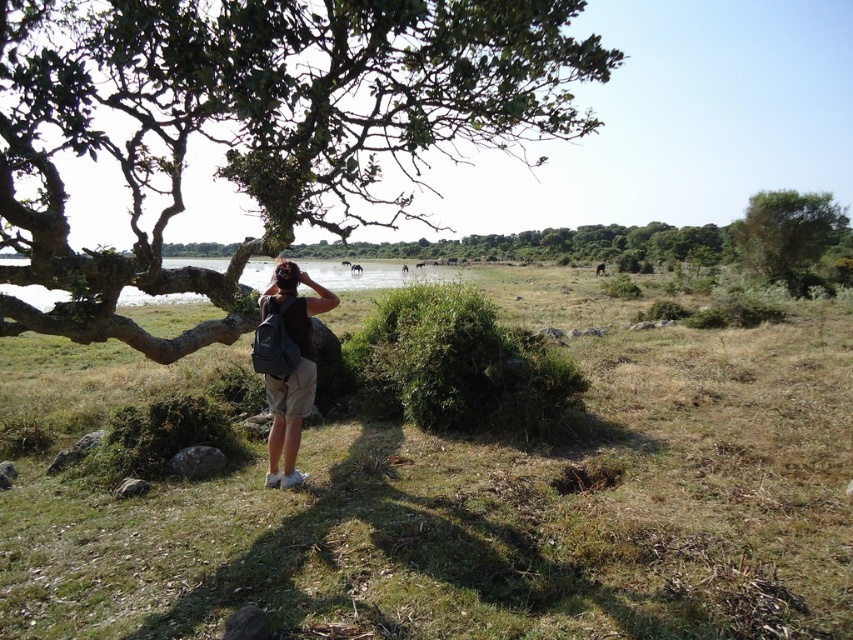
Question: Which point is closer to the camera?

Choices:
 (A) (788, 237)
 (B) (305, 141)

Answer: (B)

Question: Which of the following is the closest to the observer?

Choices:
 (A) green leafy tree at upper left
 (B) green leafy bush at upper right
 (C) green grass at center

Answer: (A)

Question: Can you confirm if green leafy bush at upper right is positioned to the left of black fabric backpack at center?

Choices:
 (A) no
 (B) yes

Answer: (A)

Question: Can you confirm if green leafy tree at upper left is smaller than green leafy bush at upper right?

Choices:
 (A) yes
 (B) no

Answer: (B)

Question: Can you confirm if green grass at center is smaller than green leafy bush at upper right?

Choices:
 (A) yes
 (B) no

Answer: (A)

Question: Which of the following is the farthest from the observer?

Choices:
 (A) black fabric backpack at center
 (B) green leafy bush at upper right

Answer: (B)